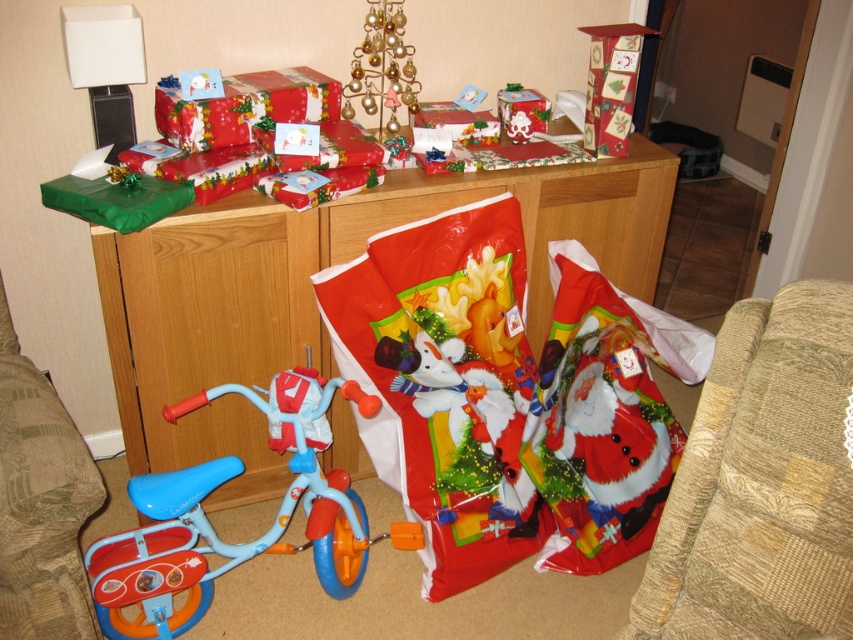
You are standing in the living room and want to place a new decoration between the two points, point (277,253) and point (61,506). Which point should you start from to ensure the decoration is placed correctly?

Since point (277,253) is behind point (61,506), you should start from point (61,506) to place the decoration in between them.

You are planning to place a rectangular box that is 2 feet wide on the wooden cabinet at center and the beige fabric armchair at lower right. Which surface can accommodate the box based on their widths?

The wooden cabinet at center has a greater width than the beige fabric armchair at lower right, so the box can be placed on the wooden cabinet at center but not on the beige fabric armchair at lower right.

You are a parent trying to place a new toy box between the beige fabric armchair at lower right and the light blue plastic bicycle at lower left. The toy box is 28 inches wide. Will it fit in the space between them?

The beige fabric armchair at lower right and light blue plastic bicycle at lower left are 30.26 inches apart. The toy box is 28 inches wide, so it will fit in the space between them since the distance is greater than the toy box width.